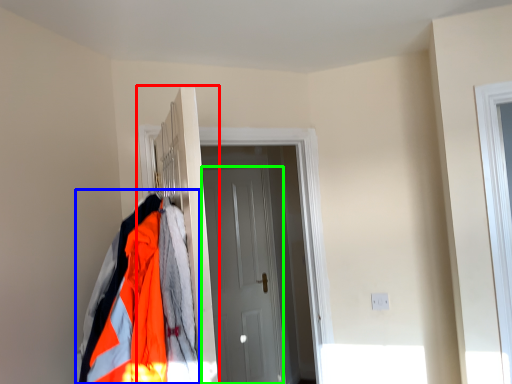
Question: Which object is the closest to the closet (highlighted by a red box)? Choose among these: jacket (highlighted by a blue box) or door (highlighted by a green box).

Choices:
 (A) jacket
 (B) door

Answer: (A)